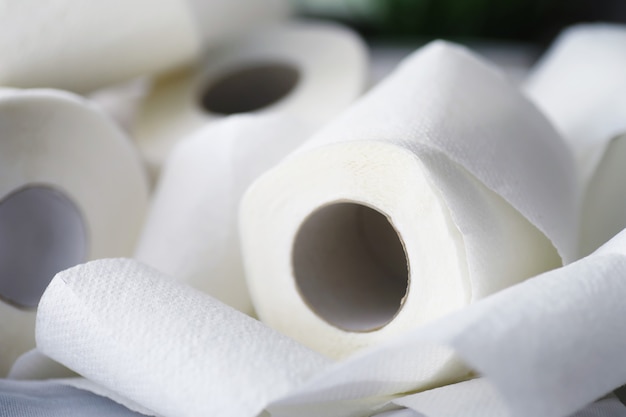
This screenshot has height=417, width=626. In order to click on toilet paper sheets in this screenshot , I will do `click(193, 375)`, `click(198, 189)`, `click(488, 135)`, `click(568, 299)`.